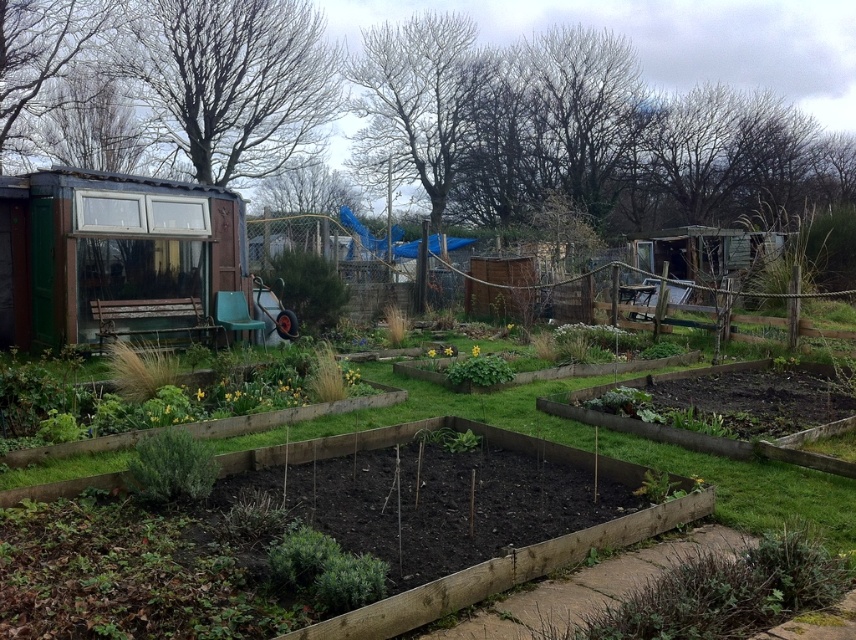
Question: Is brown wooden raised beds at center thinner than yellow matte flower bed at center?

Choices:
 (A) no
 (B) yes

Answer: (B)

Question: Among these objects, which one is nearest to the camera?

Choices:
 (A) brown wooden raised beds at center
 (B) yellow matte flower bed at center

Answer: (A)

Question: Which point is farther to the camera?

Choices:
 (A) (462, 385)
 (B) (617, 426)

Answer: (A)

Question: Does brown wooden raised beds at center lie behind yellow matte flower bed at center?

Choices:
 (A) no
 (B) yes

Answer: (A)

Question: Which of the following is the farthest from the observer?

Choices:
 (A) (99, 483)
 (B) (501, 376)

Answer: (B)

Question: Can you confirm if brown wooden raised beds at center is positioned to the left of yellow matte flower bed at center?

Choices:
 (A) no
 (B) yes

Answer: (B)